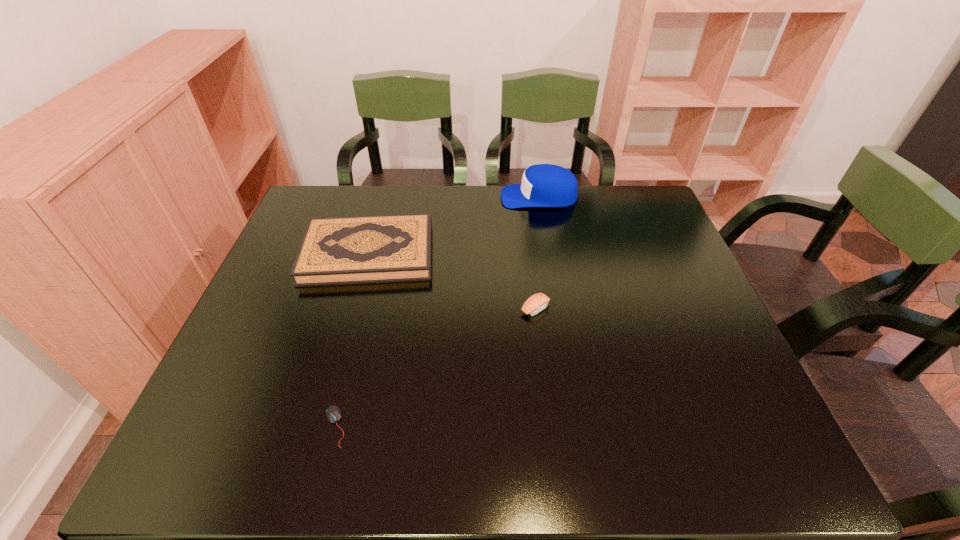
The width and height of the screenshot is (960, 540). In order to click on vacant space located 0.210m on the front-facing side of the baseball cap in this screenshot , I will do `click(437, 197)`.

In order to click on vacant region located on the front of the hardback book in this screenshot , I will do `click(329, 395)`.

At what (x,y) coordinates should I click in order to perform the action: click on free space located 0.280m on the front of the third farthest object. Please return your answer as a coordinate pair (x, y). The image size is (960, 540). Looking at the image, I should click on (549, 425).

Find the location of a particular element. blank space located 0.170m on the back of the shortest object is located at coordinates (356, 340).

Where is `baseball cap located at the far edge`? baseball cap located at the far edge is located at coordinates (543, 185).

Find the location of a particular element. hardback book that is at the far edge is located at coordinates (365, 249).

Where is `object at the near edge`? object at the near edge is located at coordinates (333, 413).

Where is `object present at the left edge`? This screenshot has height=540, width=960. object present at the left edge is located at coordinates (365, 249).

Where is `object that is at the far left corner`? This screenshot has height=540, width=960. object that is at the far left corner is located at coordinates (365, 249).

I want to click on free space at the far edge, so click(412, 197).